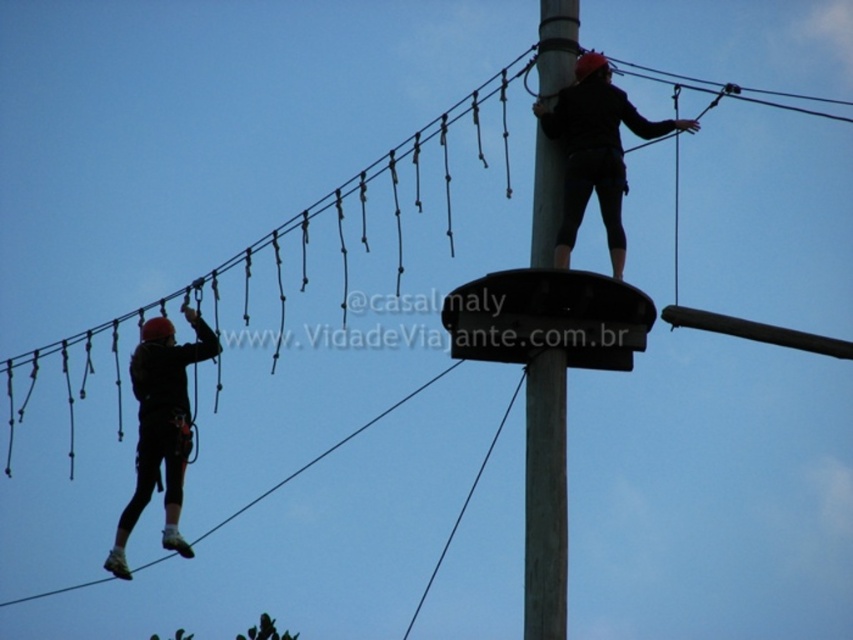
You are participating in a high ropes course and need to move from the black matte helmet at left to the gray metallic pole at center. Which direction should you move?

The gray metallic pole at center is to the right of the black matte helmet at left, so you should move to the right to reach it.

You are participating in a high ropes course and notice the gray metallic pole at center and the black matte helmet at upper center. Which object is located below the other?

The gray metallic pole at center is positioned under the black matte helmet at upper center.

You are planning to install a new safety net for the high ropes course. The gray metallic pole at center is located at point (544,499). Where should you place the safety net to ensure it covers the highest point of the course?

The highest point of the course is at the gray metallic pole at center located at point (544,499), so the safety net should be placed there to cover it.